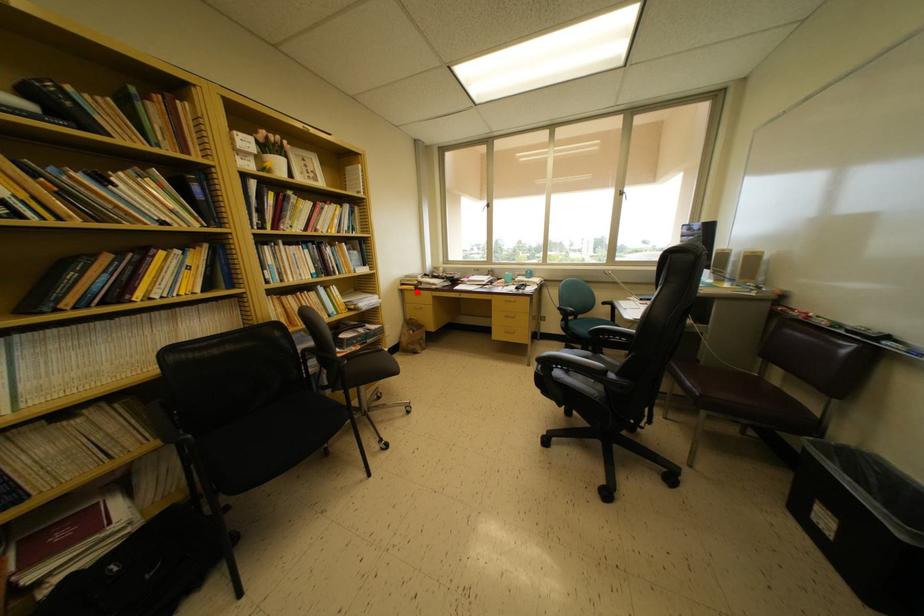
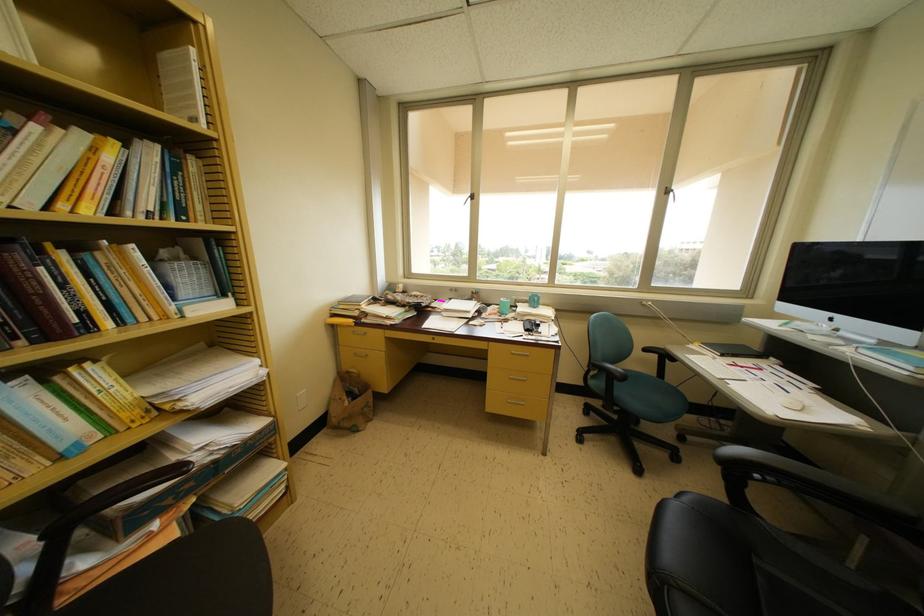
Find the pixel in the second image that matches the highlighted location in the first image.

(355, 326)